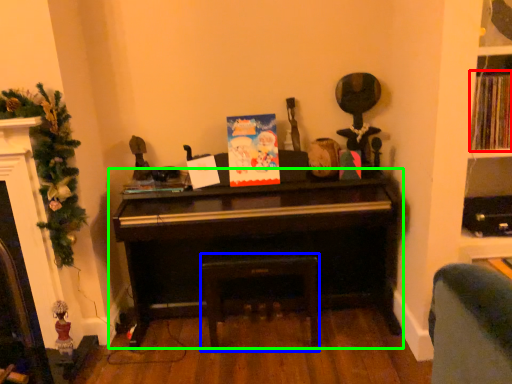
Question: Which object is the closest to the book (highlighted by a red box)? Choose among these: stool (highlighted by a blue box) or piano (highlighted by a green box).

Choices:
 (A) stool
 (B) piano

Answer: (B)